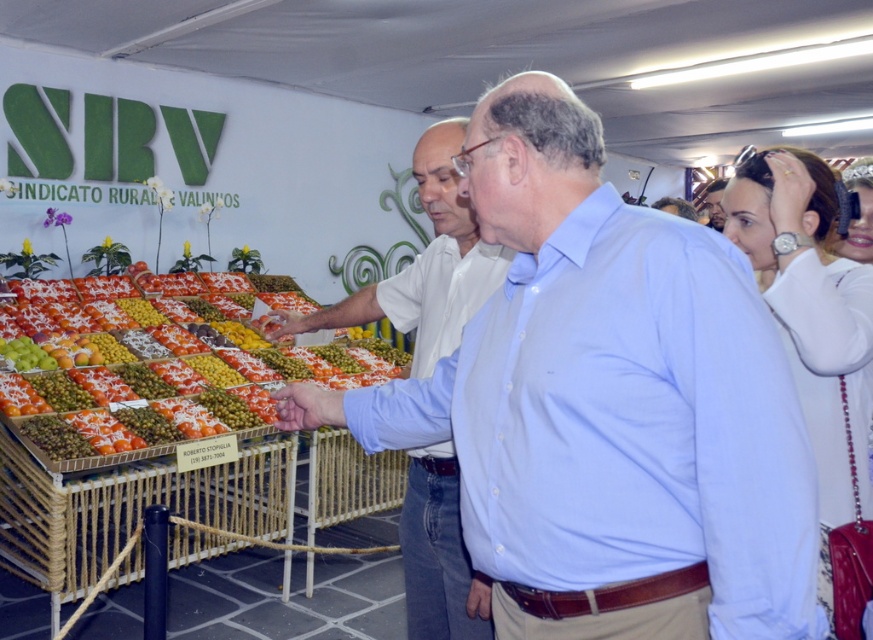
In the scene shown: You are a customer at the SRV Rural Union of Valinos market. You see two shirts displayed at the center of the stall. The light blue shirt at center and the matte white shirt at center. Which shirt is positioned lower on the display?

The light blue shirt at center is located below the matte white shirt at center, so the light blue shirt at center is positioned lower on the display.

You are a vendor at the SRV Rural Union of Valinos market. You have a shiny plastic tray at center and a matte white shirt at center. A customer asks if the tray can fit over the shirt without folding the shirt. Based on their sizes, can it fit?

The shiny plastic tray at center might be wider than matte white shirt at center, so there is a possibility that the tray cannot fit over the shirt without folding since the tray could be wider.

Consider the image. You are a customer at the SRV Rural Union of Valinos market. You see a vendor wearing a light blue shirt at center. Where exactly is the vendor standing in relation to the fresh produce displayed in wicker baskets?

The light blue shirt at center is located at point [425,266], which means the vendor is positioned slightly to the right and above the center of the scene, near the fresh produce displayed in wicker baskets.